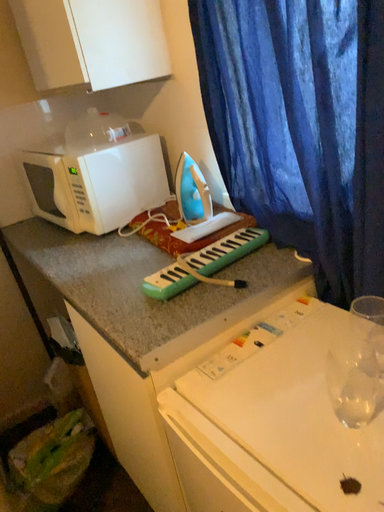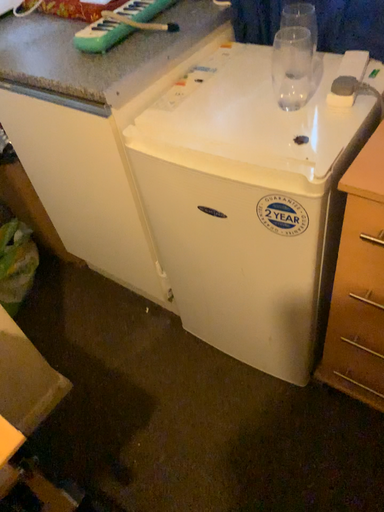
Question: How did the camera likely rotate when shooting the video?

Choices:
 (A) rotated right
 (B) rotated left

Answer: (A)